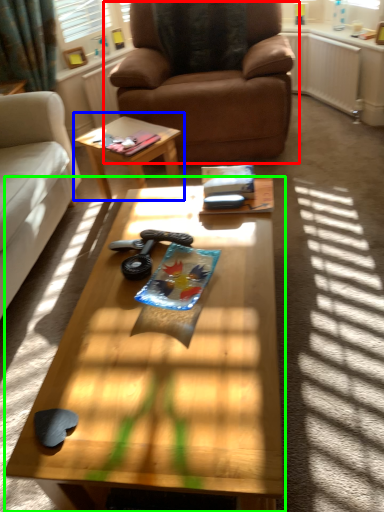
Question: Based on their relative distances, which object is nearer to chair (highlighted by a red box)? Choose from coffee table (highlighted by a blue box) and coffee table (highlighted by a green box).

Choices:
 (A) coffee table
 (B) coffee table

Answer: (A)